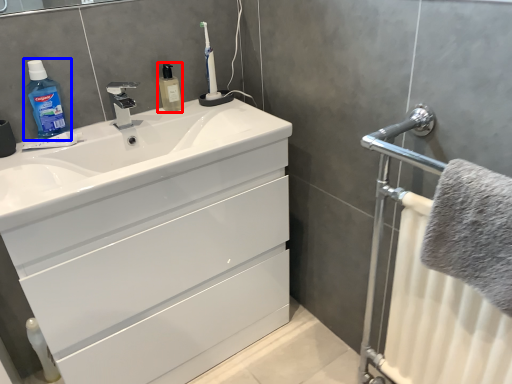
Question: Which object is further to the camera taking this photo, mouthwash (highlighted by a red box) or cleaning product (highlighted by a blue box)?

Choices:
 (A) mouthwash
 (B) cleaning product

Answer: (A)